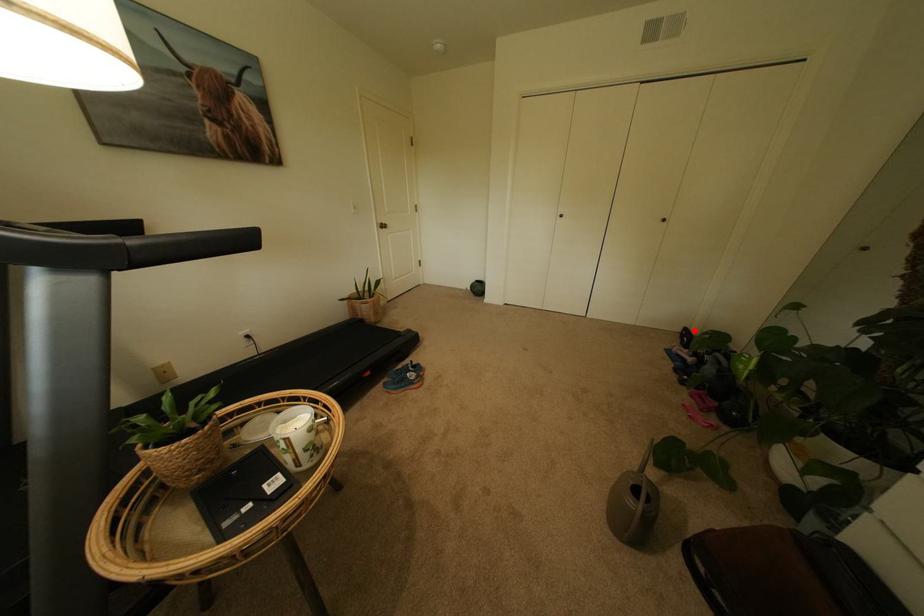
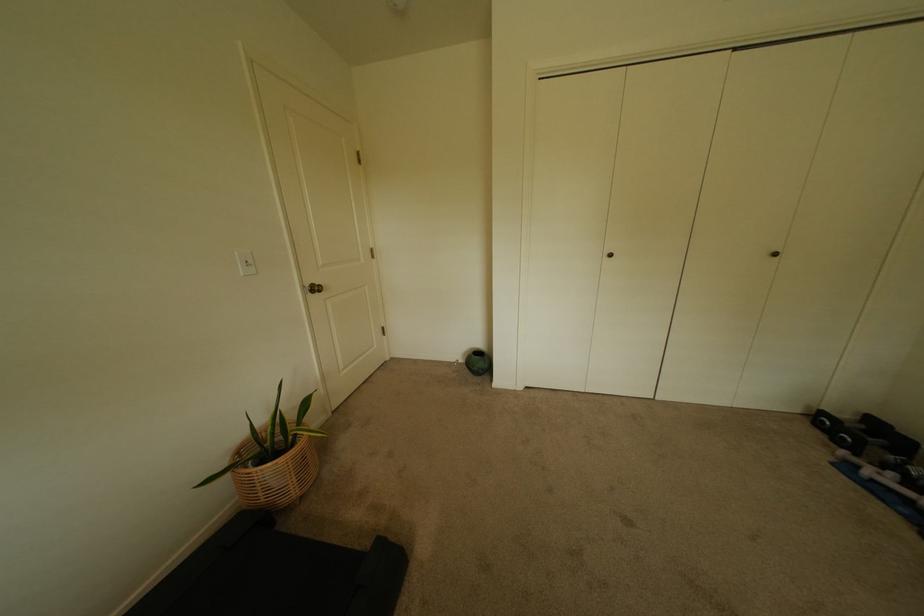
Where in the second image is the point corresponding to the highlighted location from the first image?

(831, 415)